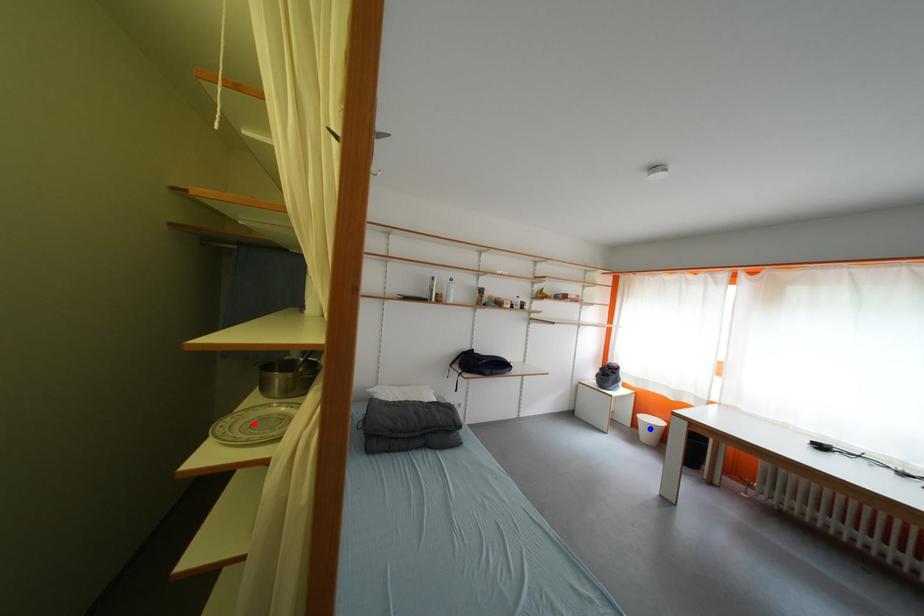
Question: Two points are marked on the image. Which point is closer to the camera?

Choices:
 (A) Blue point is closer.
 (B) Red point is closer.

Answer: (B)